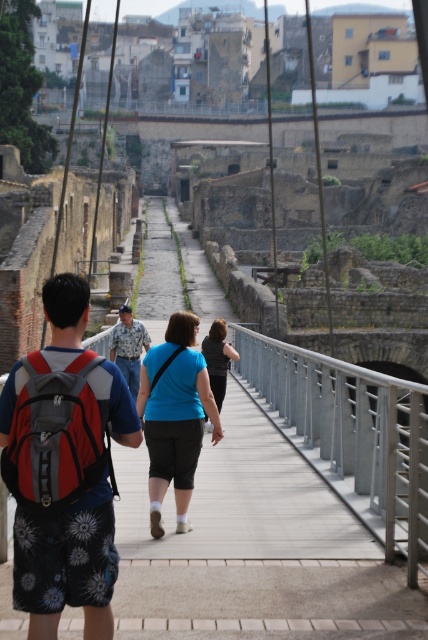
Question: Is camouflage uniform at center positioned at the back of black fabric shirt at center?

Choices:
 (A) yes
 (B) no

Answer: (A)

Question: Which point is farther from the camera taking this photo?

Choices:
 (A) click(x=162, y=390)
 (B) click(x=127, y=316)
 (C) click(x=219, y=372)

Answer: (B)

Question: Is blue matte shirt at center below camouflage uniform at center?

Choices:
 (A) no
 (B) yes

Answer: (B)

Question: Does red backpack at left have a greater width compared to camouflage uniform at center?

Choices:
 (A) yes
 (B) no

Answer: (A)

Question: Which point is farther to the camera?

Choices:
 (A) blue matte shirt at center
 (B) red fabric backpack at center
 (C) red backpack at left
 (D) camouflage uniform at center

Answer: (D)

Question: Which point is closer to the camera?

Choices:
 (A) black fabric shirt at center
 (B) red backpack at left

Answer: (B)